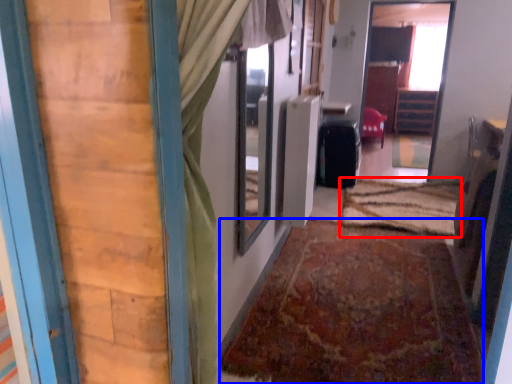
Question: Which point is closer to the camera, doormat (highlighted by a red box) or doormat (highlighted by a blue box)?

Choices:
 (A) doormat
 (B) doormat

Answer: (B)